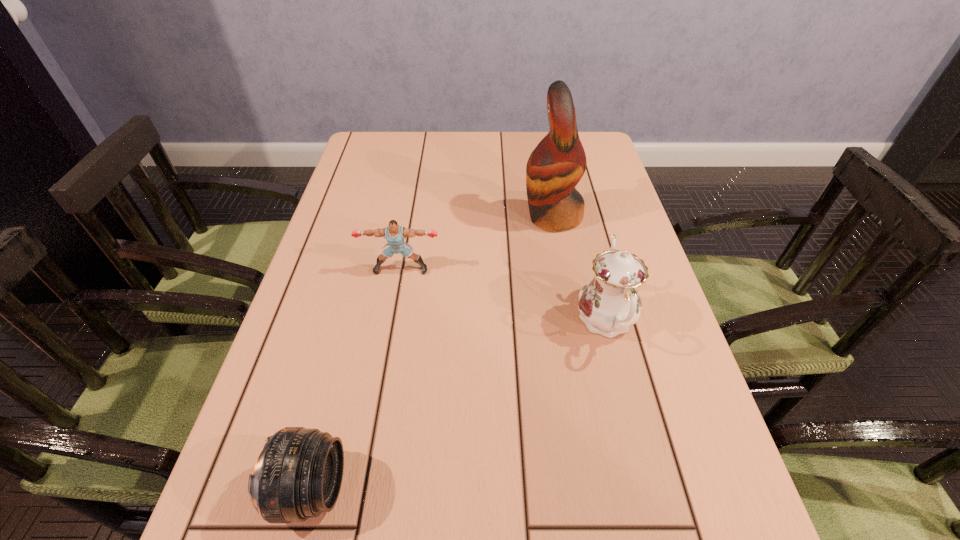
Find the location of a particular element. This screenshot has width=960, height=540. vacant area in the image that satisfies the following two spatial constraints: 1. on the face of the tallest object; 2. on the front-facing side of the puncher is located at coordinates (562, 269).